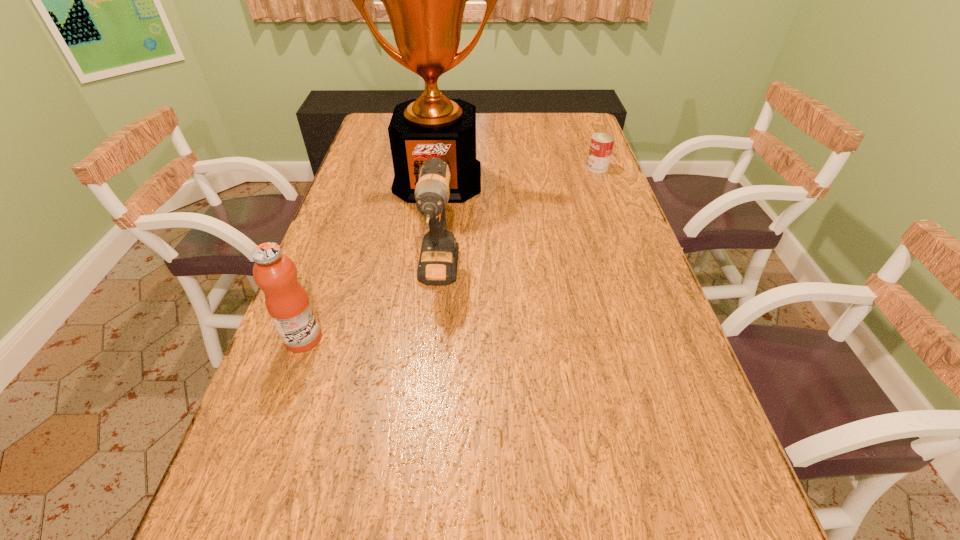
What are the coordinates of `free space between the tallest object and the rightmost object` in the screenshot? It's located at (517, 173).

Locate an element on the screen. free spot between the third farthest object and the shortest object is located at coordinates (517, 221).

Where is `vacant area that lies between the nearest object and the tallest object`? Image resolution: width=960 pixels, height=540 pixels. vacant area that lies between the nearest object and the tallest object is located at coordinates (371, 259).

The width and height of the screenshot is (960, 540). Find the location of `free space between the nearest object and the trophy cup`. free space between the nearest object and the trophy cup is located at coordinates (371, 259).

Where is `object that is the second closest to the drill`? The height and width of the screenshot is (540, 960). object that is the second closest to the drill is located at coordinates (425, 0).

You are a GUI agent. You are given a task and a screenshot of the screen. Output one action in this format:
    pyautogui.click(x=<x>, y=<y>)
    Task: Click on the object that is the nearest to the trophy cup
    The image size is (960, 540).
    Given the screenshot: What is the action you would take?
    point(438,260)

At what (x,y) coordinates should I click in order to perform the action: click on free spot that satisfies the following two spatial constraints: 1. on the front label of the can; 2. on the front of the trophy cup with the label. Please return your answer as a coordinate pair (x, y). The image size is (960, 540). Looking at the image, I should click on click(x=602, y=179).

This screenshot has height=540, width=960. Identify the location of free space that satisfies the following two spatial constraints: 1. on the front of the tallest object with the label; 2. on the front label of the nearest object. (418, 339).